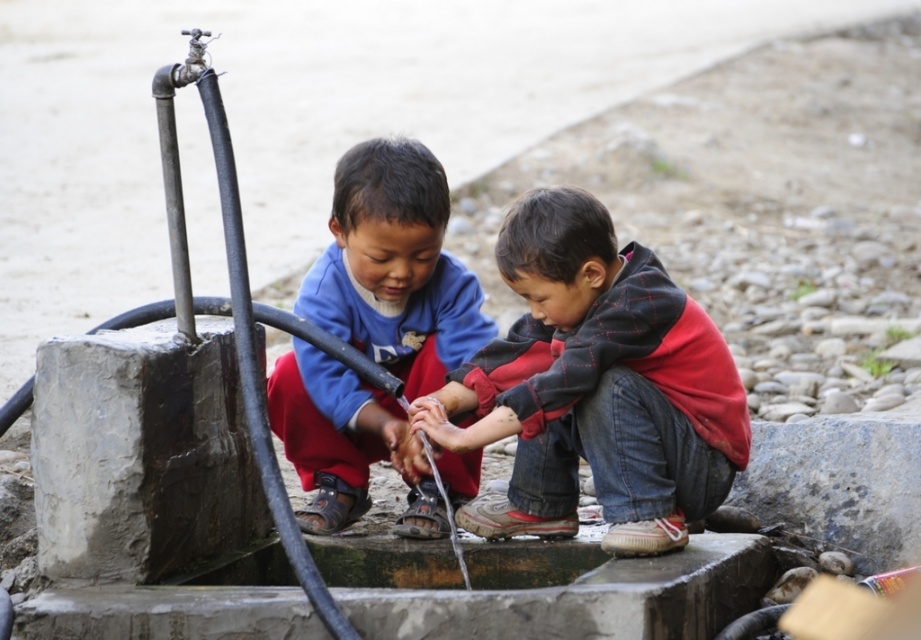
Which is behind, point (460, 515) or point (306, 465)?

Point (306, 465)

Is red plaid hoodie at center to the left of blue fleece jacket at center from the viewer's perspective?

Incorrect, red plaid hoodie at center is not on the left side of blue fleece jacket at center.

What do you see at coordinates (596, 387) in the screenshot? I see `red plaid hoodie at center` at bounding box center [596, 387].

At what (x,y) coordinates should I click in order to perform the action: click on red plaid hoodie at center. Please return your answer as a coordinate pair (x, y). The image size is (921, 640). Looking at the image, I should click on (596, 387).